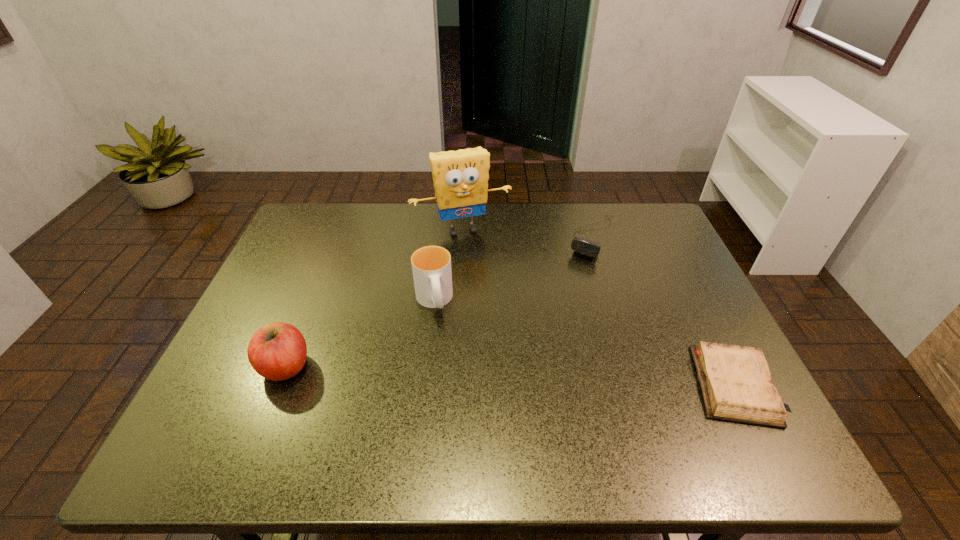
This screenshot has height=540, width=960. What are the coordinates of `free space located on the face of the sponge` in the screenshot? It's located at (505, 314).

Where is `vacant space situated 0.360m on the face of the sponge`? The width and height of the screenshot is (960, 540). vacant space situated 0.360m on the face of the sponge is located at coordinates (511, 328).

Image resolution: width=960 pixels, height=540 pixels. Identify the location of blank area located 0.310m on the front-facing side of the second object from right to left. (545, 331).

Where is `free point located 0.380m on the front-facing side of the second object from right to left`? Image resolution: width=960 pixels, height=540 pixels. free point located 0.380m on the front-facing side of the second object from right to left is located at coordinates coord(535,351).

What are the coordinates of `vacant point located 0.210m on the front-facing side of the second object from right to left` in the screenshot? It's located at click(560, 305).

You are a GUI agent. You are given a task and a screenshot of the screen. Output one action in this format:
    pyautogui.click(x=<x>, y=<y>)
    Task: Click on the vacant region located with the handle on the side of the cup
    The width and height of the screenshot is (960, 540).
    Given the screenshot: What is the action you would take?
    pyautogui.click(x=446, y=374)

The image size is (960, 540). Find the location of `free space located 0.170m with the handle on the side of the cup`. free space located 0.170m with the handle on the side of the cup is located at coordinates (447, 377).

The height and width of the screenshot is (540, 960). In order to click on vacant space located 0.140m with the handle on the side of the cup in this screenshot , I will do `click(444, 367)`.

You are a GUI agent. You are given a task and a screenshot of the screen. Output one action in this format:
    pyautogui.click(x=<x>, y=<y>)
    Task: Click on the sponge that is at the far edge
    Image resolution: width=960 pixels, height=540 pixels.
    Given the screenshot: What is the action you would take?
    pyautogui.click(x=460, y=177)

You are a GUI agent. You are given a task and a screenshot of the screen. Output one action in this format:
    pyautogui.click(x=<x>, y=<y>)
    Task: Click on the webcam located at the far edge
    
    Given the screenshot: What is the action you would take?
    pyautogui.click(x=582, y=246)